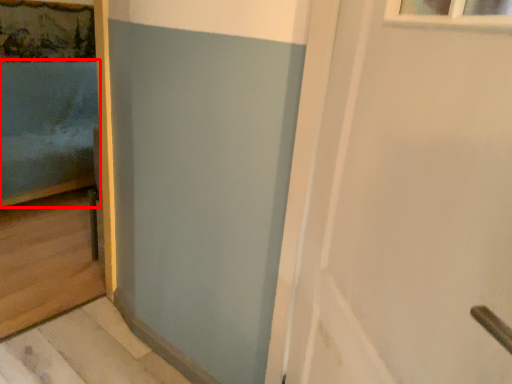
Question: From the image, what is the correct spatial relationship of bed (annotated by the red box) in relation to door?

Choices:
 (A) left
 (B) right

Answer: (A)